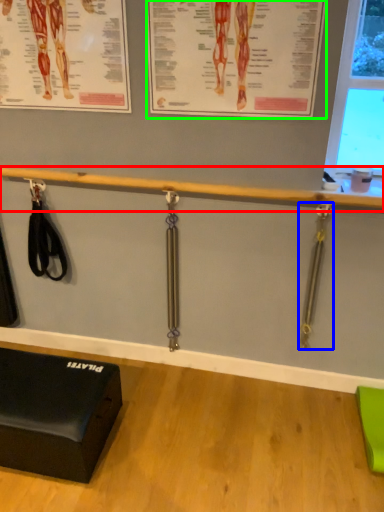
Question: Which object is the closest to the beam (highlighted by a red box)? Choose among these: weight (highlighted by a blue box) or poster page (highlighted by a green box).

Choices:
 (A) weight
 (B) poster page

Answer: (B)